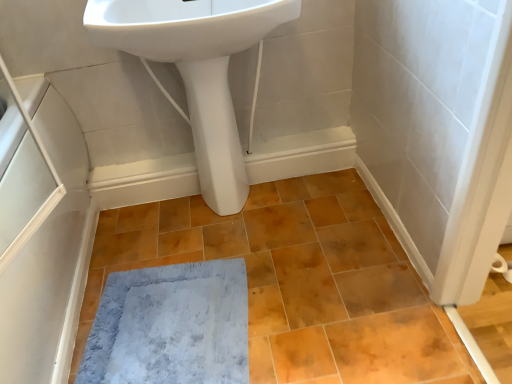
Find the location of a particular element. free spot in front of white glossy pedestal at center is located at coordinates (229, 236).